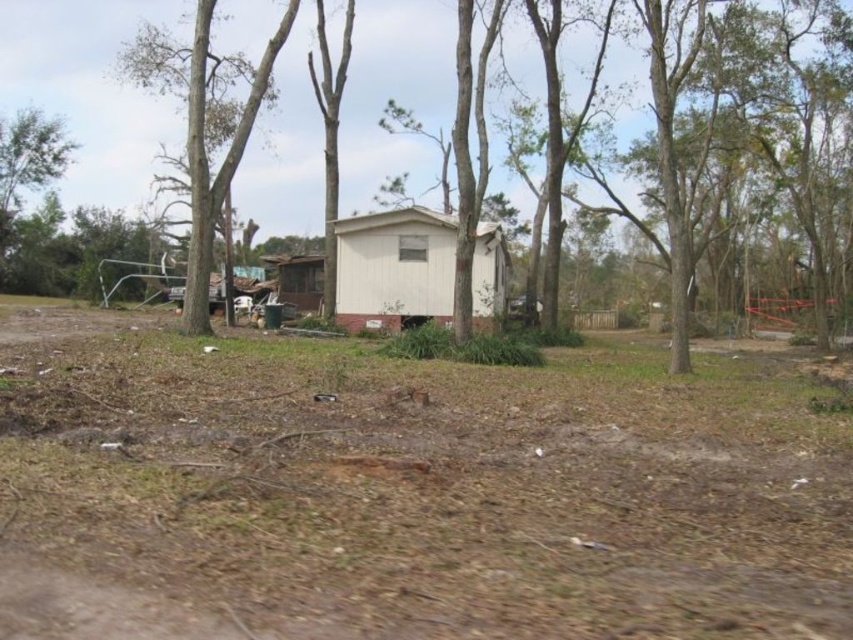
Question: In this image, where is brown dirt track at center located relative to white matte cabin at center?

Choices:
 (A) above
 (B) below

Answer: (B)

Question: In this image, where is white matte cabin at center located relative to brown rough tree at left?

Choices:
 (A) left
 (B) right

Answer: (B)

Question: Among these points, which one is farthest from the camera?

Choices:
 (A) (340, 260)
 (B) (193, 259)

Answer: (A)

Question: Which object is closer to the camera taking this photo?

Choices:
 (A) white matte cabin at center
 (B) bare wood tree at center
 (C) brown dirt track at center
 (D) brown corrugated metal hut at center

Answer: (C)

Question: Which point is farther from the camera taking this photo?

Choices:
 (A) (341, 81)
 (B) (144, 49)

Answer: (A)

Question: Can you confirm if brown rough tree at left is positioned above brown corrugated metal hut at center?

Choices:
 (A) yes
 (B) no

Answer: (A)